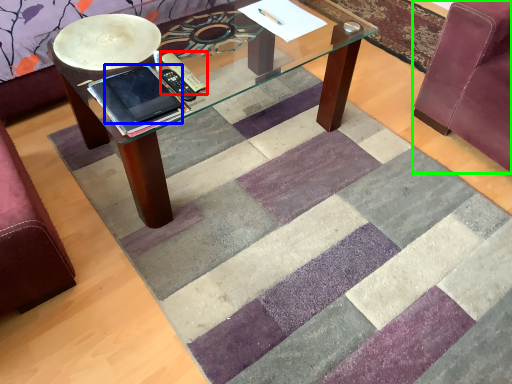
Question: Which object is positioned farthest from remote (highlighted by a red box)? Select from ipad (highlighted by a blue box) and swivel chair (highlighted by a green box).

Choices:
 (A) ipad
 (B) swivel chair

Answer: (B)